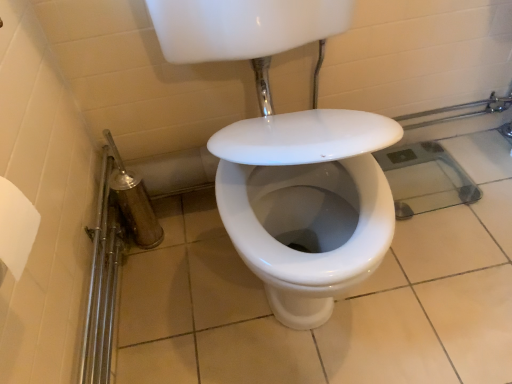
Question: Choose the correct answer: Is shiny metallic shower at lower left inside white glossy sink at center or outside it?

Choices:
 (A) inside
 (B) outside

Answer: (B)

Question: Would you say shiny metallic shower at lower left is to the left or to the right of white glossy sink at center in the picture?

Choices:
 (A) left
 (B) right

Answer: (A)

Question: From a real-world perspective, relative to white glossy sink at center, is shiny metallic shower at lower left vertically above or below?

Choices:
 (A) below
 (B) above

Answer: (A)

Question: Considering the positions of point (278, 119) and point (120, 173), is point (278, 119) closer or farther from the camera than point (120, 173)?

Choices:
 (A) farther
 (B) closer

Answer: (B)

Question: Do you think white glossy sink at center is within shiny metallic shower at lower left, or outside of it?

Choices:
 (A) outside
 (B) inside

Answer: (A)

Question: From a real-world perspective, is white glossy sink at center positioned above or below shiny metallic shower at lower left?

Choices:
 (A) below
 (B) above

Answer: (B)

Question: Is white glossy sink at center bigger or smaller than shiny metallic shower at lower left?

Choices:
 (A) small
 (B) big

Answer: (B)